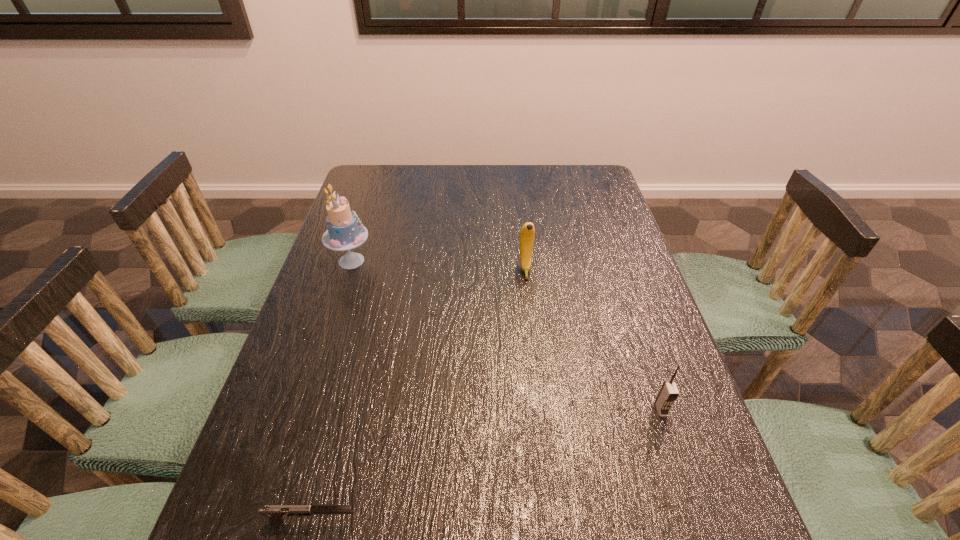
In order to click on the tallest object in this screenshot , I will do `click(345, 231)`.

Find the location of `the second object from right to left`. the second object from right to left is located at coordinates (526, 241).

The width and height of the screenshot is (960, 540). I want to click on the third farthest object, so click(668, 393).

What are the coordinates of `the rightmost object` in the screenshot? It's located at (668, 393).

In order to click on the nearest object in this screenshot , I will do `click(275, 512)`.

In order to click on the shortest object in this screenshot , I will do `click(275, 512)`.

I want to click on vacant space situated with a ladder on the side of the tallest object, so click(x=512, y=261).

At what (x,y) coordinates should I click in order to perform the action: click on free region located 0.290m from the stem of the banana. Please return your answer as a coordinate pair (x, y). This screenshot has height=540, width=960. Looking at the image, I should click on point(537,369).

At what (x,y) coordinates should I click in order to perform the action: click on free spot located on the front-facing side of the rightmost object. Please return your answer as a coordinate pair (x, y). This screenshot has height=540, width=960. Looking at the image, I should click on (678, 460).

The image size is (960, 540). Find the location of `vacant area situated 0.150m at the muzzle end of the shortest object`. vacant area situated 0.150m at the muzzle end of the shortest object is located at coordinates (444, 520).